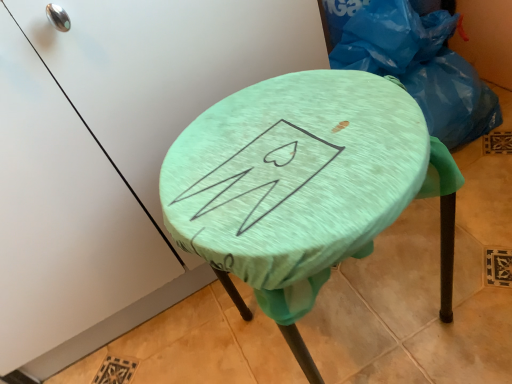
Find the location of a particular element. The image size is (512, 384). free space to the left of mint fabric-covered stool at center is located at coordinates (198, 337).